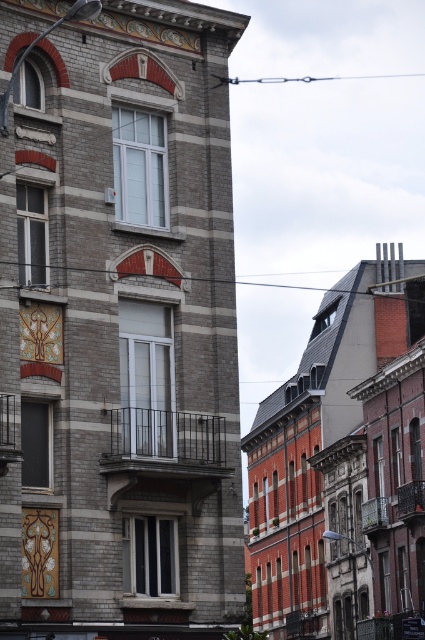
Can you confirm if gold ornate clock at upper center is thinner than gold metallic clock at upper center?

Incorrect, gold ornate clock at upper center's width is not less than gold metallic clock at upper center's.

Is gold ornate clock at upper center above gold metallic clock at upper center?

Correct, gold ornate clock at upper center is located above gold metallic clock at upper center.

Locate an element on the screen. gold ornate clock at upper center is located at coordinates [138, 28].